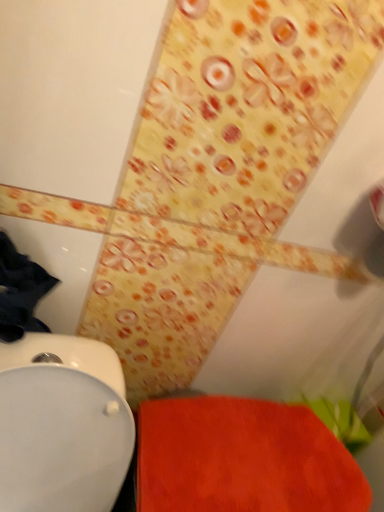
You are a GUI agent. You are given a task and a screenshot of the screen. Output one action in this format:
    pyautogui.click(x=<x>, y=<y>)
    Task: Click on the orange fabric bath mat at lower right
    
    Given the screenshot: What is the action you would take?
    pyautogui.click(x=242, y=459)

What do you see at coordinates (242, 459) in the screenshot?
I see `orange fabric bath mat at lower right` at bounding box center [242, 459].

What is the approximate width of white glossy toilet at lower left?

white glossy toilet at lower left is 13.06 inches wide.

In the scene shown: Measure the distance between white glossy toilet at lower left and camera.

white glossy toilet at lower left is 24.62 inches from camera.

Measure the distance between point [70,395] and camera.

The depth of point [70,395] is 26.34 inches.

What do you see at coordinates (62, 425) in the screenshot? The height and width of the screenshot is (512, 384). I see `white glossy toilet at lower left` at bounding box center [62, 425].

Identify the location of white glossy toilet at lower left. (62, 425).

Where is `orange fabric bath mat at lower right`? Image resolution: width=384 pixels, height=512 pixels. orange fabric bath mat at lower right is located at coordinates (242, 459).

Which is more to the right, white glossy toilet at lower left or orange fabric bath mat at lower right?

From the viewer's perspective, orange fabric bath mat at lower right appears more on the right side.

Is white glossy toilet at lower left closer to the viewer compared to orange fabric bath mat at lower right?

Yes, white glossy toilet at lower left is in front of orange fabric bath mat at lower right.

Which point is more distant from viewer, (x=35, y=461) or (x=156, y=445)?

Positioned behind is point (x=156, y=445).

From the image's perspective, which is below, white glossy toilet at lower left or orange fabric bath mat at lower right?

white glossy toilet at lower left.

From a real-world perspective, is white glossy toilet at lower left positioned above or below orange fabric bath mat at lower right?

white glossy toilet at lower left is below orange fabric bath mat at lower right.

Considering the sizes of objects white glossy toilet at lower left and orange fabric bath mat at lower right in the image provided, who is thinner, white glossy toilet at lower left or orange fabric bath mat at lower right?

orange fabric bath mat at lower right is thinner.

Looking at this image, considering the sizes of objects white glossy toilet at lower left and orange fabric bath mat at lower right in the image provided, who is shorter, white glossy toilet at lower left or orange fabric bath mat at lower right?

With less height is orange fabric bath mat at lower right.

Can you confirm if white glossy toilet at lower left is bigger than orange fabric bath mat at lower right?

Yes.

Is white glossy toilet at lower left outside of orange fabric bath mat at lower right?

Absolutely, white glossy toilet at lower left is external to orange fabric bath mat at lower right.

Are white glossy toilet at lower left and orange fabric bath mat at lower right beside each other?

No, white glossy toilet at lower left is not with orange fabric bath mat at lower right.

Is white glossy toilet at lower left oriented towards orange fabric bath mat at lower right?

No, white glossy toilet at lower left is not aimed at orange fabric bath mat at lower right.

The image size is (384, 512). I want to click on toilet that is under the orange fabric bath mat at lower right (from a real-world perspective), so click(62, 425).

Which object is positioned more to the right, orange fabric bath mat at lower right or white glossy toilet at lower left?

orange fabric bath mat at lower right.

Between orange fabric bath mat at lower right and white glossy toilet at lower left, which one is positioned in front?

white glossy toilet at lower left is closer to the camera.

Does point (147, 484) appear closer or farther from the camera than point (75, 347)?

Point (147, 484) appears to be closer to the viewer than point (75, 347).

From the image's perspective, is orange fabric bath mat at lower right under white glossy toilet at lower left?

No, from the image's perspective, orange fabric bath mat at lower right is not beneath white glossy toilet at lower left.

From a real-world perspective, relative to white glossy toilet at lower left, is orange fabric bath mat at lower right vertically above or below?

From a real-world perspective, orange fabric bath mat at lower right is physically above white glossy toilet at lower left.

Between orange fabric bath mat at lower right and white glossy toilet at lower left, which one has smaller width?

Thinner between the two is orange fabric bath mat at lower right.

Considering the sizes of objects orange fabric bath mat at lower right and white glossy toilet at lower left in the image provided, who is taller, orange fabric bath mat at lower right or white glossy toilet at lower left?

Standing taller between the two is white glossy toilet at lower left.

Who is bigger, orange fabric bath mat at lower right or white glossy toilet at lower left?

white glossy toilet at lower left.

Is orange fabric bath mat at lower right completely or partially outside of white glossy toilet at lower left?

Absolutely, orange fabric bath mat at lower right is external to white glossy toilet at lower left.

Is orange fabric bath mat at lower right placed right next to white glossy toilet at lower left?

No, orange fabric bath mat at lower right is not touching white glossy toilet at lower left.

Is orange fabric bath mat at lower right positioned with its back to white glossy toilet at lower left?

No, orange fabric bath mat at lower right's orientation is not away from white glossy toilet at lower left.

The width and height of the screenshot is (384, 512). I want to click on toilet below the orange fabric bath mat at lower right (from the image's perspective), so click(62, 425).

Identify the location of bath mat on the right side of white glossy toilet at lower left. This screenshot has width=384, height=512. pyautogui.click(x=242, y=459).

You are a GUI agent. You are given a task and a screenshot of the screen. Output one action in this format:
    pyautogui.click(x=<x>, y=<y>)
    Task: Click on the toilet in front of the orange fabric bath mat at lower right
    The height and width of the screenshot is (512, 384).
    Given the screenshot: What is the action you would take?
    pyautogui.click(x=62, y=425)